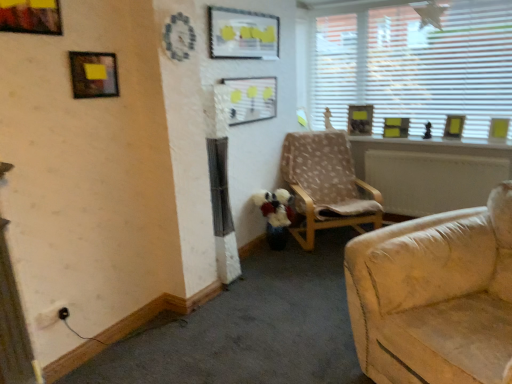
Question: In the image, is matte plastic picture frame at center, positioned as the 4th picture frame in front-to-back order, on the left side or the right side of white blinds at upper right?

Choices:
 (A) right
 (B) left

Answer: (B)

Question: From a real-world perspective, is matte plastic picture frame at center, which is the fourth picture frame in left-to-right order, positioned above or below white blinds at upper right?

Choices:
 (A) below
 (B) above

Answer: (A)

Question: Which object is positioned farthest from the matte plastic picture frame at center, marked as the 5th picture frame in a back-to-front arrangement?

Choices:
 (A) black plastic electric outlet at lower left
 (B) wooden picture frame at upper right, the 5th picture frame viewed from the left
 (C) metallic gold picture frame at upper left, marked as the 1th picture frame in a left-to-right arrangement
 (D) matte black picture frame at upper left, the second picture frame in the left-to-right sequence
 (E) yellow paper picture frame at upper right, positioned as the 8th picture frame in left-to-right order

Answer: (E)

Question: Estimate the real-world distances between objects in this image. Which object is closer to the yellow paper picture frame at upper right, which is the fourth picture frame in back-to-front order?

Choices:
 (A) matte black picture frame at upper left, the second picture frame in the left-to-right sequence
 (B) matte plastic picture frame at upper center, which is counted as the 6th picture frame, starting from the back
 (C) black plastic electric outlet at lower left
 (D) yellow matte picture frame at upper right, the 2th picture frame in the back-to-front sequence
 (E) metallic gold picture frame at upper left, which is counted as the 8th picture frame, starting from the back

Answer: (D)